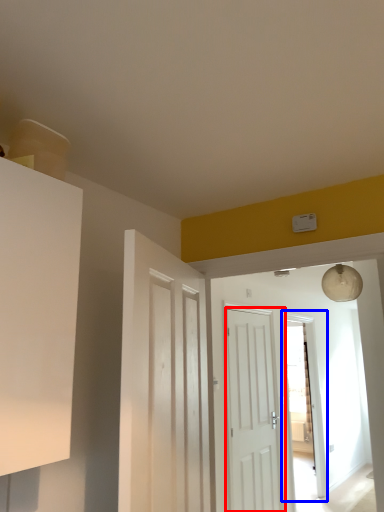
Question: Which object appears farthest to the camera in this image, door (highlighted by a red box) or glass door (highlighted by a blue box)?

Choices:
 (A) door
 (B) glass door

Answer: (B)